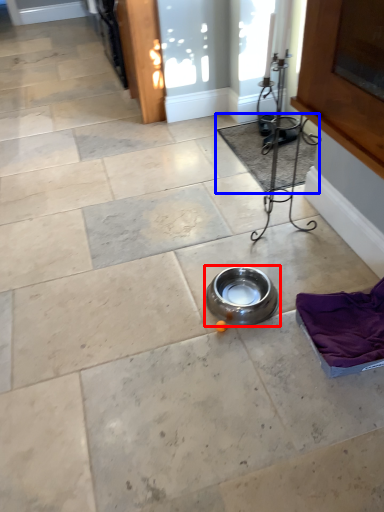
Question: Which point is further to the camera, bowl (highlighted by a red box) or mat (highlighted by a blue box)?

Choices:
 (A) bowl
 (B) mat

Answer: (B)